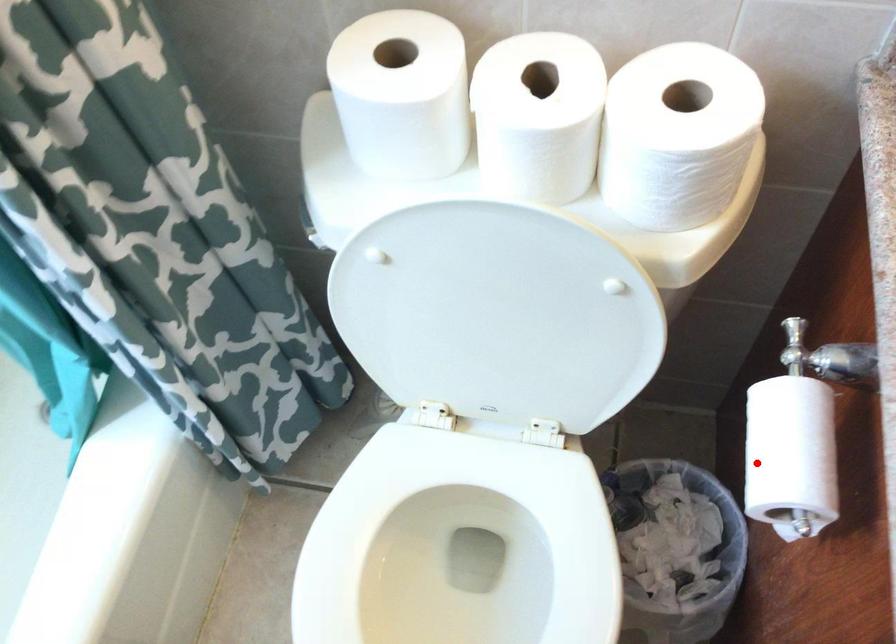
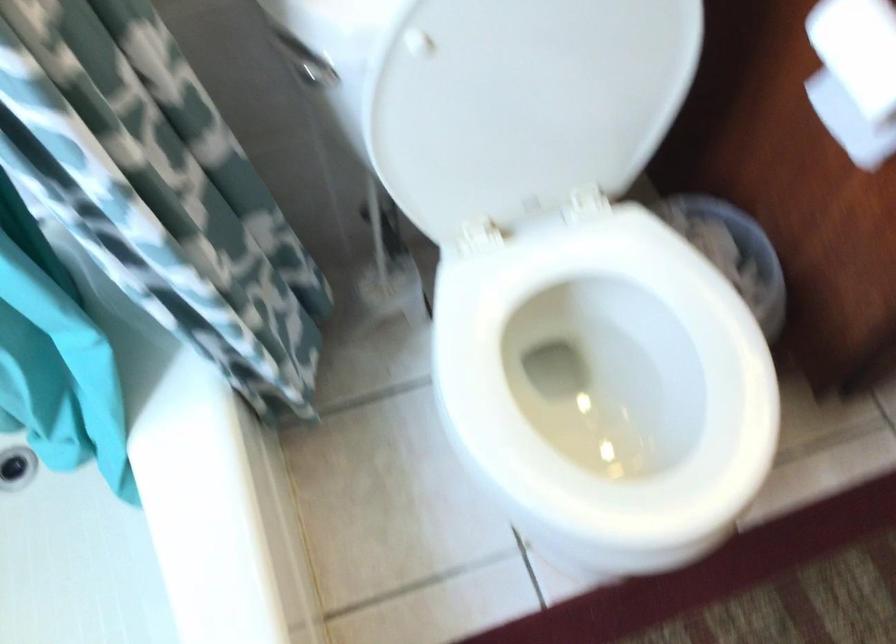
Where in the second image is the point corresponding to the highlighted location from the first image?

(855, 76)